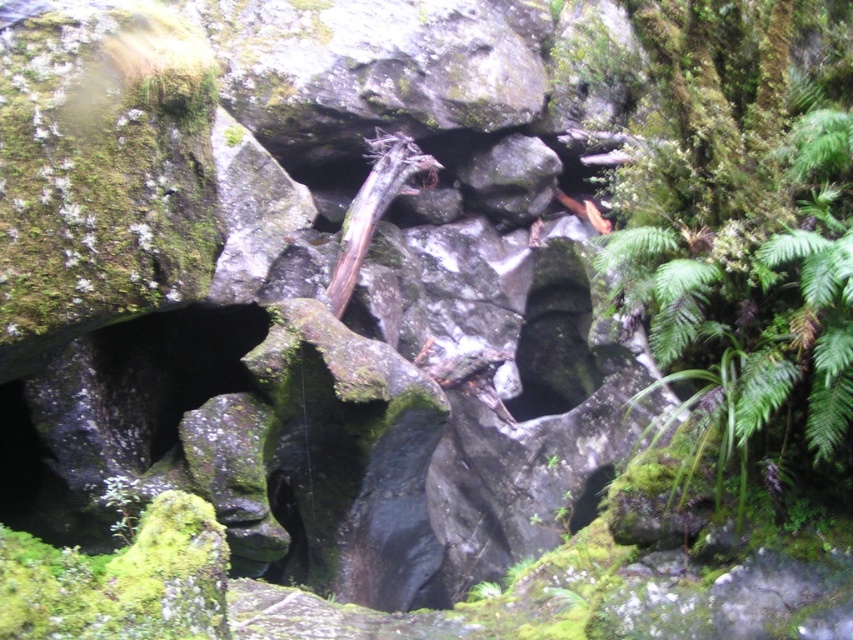
You are a hiker carrying a 5 meter long rope. You need to cross a gap between the green mossy plant at right and the brown rough tree trunk at center. Can you safely use the rope to cross the gap?

The distance between the green mossy plant at right and the brown rough tree trunk at center is 4.64 meters, which is shorter than the 5 meter rope. Therefore, the rope can safely span the gap between them.

You are a hiker trying to navigate through the rugged landscape. You see the green mossy plant at right and the brown rough tree trunk at center. Which object is closer to you?

The green mossy plant at right is closer because it is in front of the brown rough tree trunk at center.